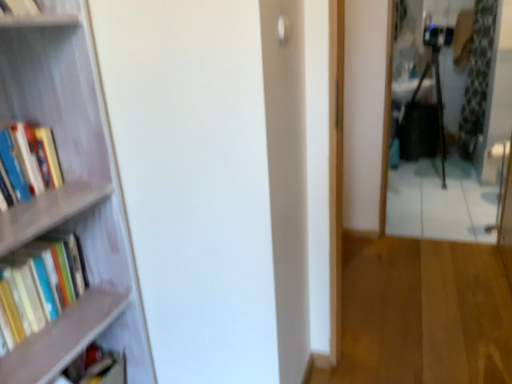
Question: Can you confirm if wooden floor at center is positioned to the left of green floral fabric curtain at right?

Choices:
 (A) yes
 (B) no

Answer: (A)

Question: Is wooden floor at center oriented towards green floral fabric curtain at right?

Choices:
 (A) no
 (B) yes

Answer: (A)

Question: Is wooden floor at center not close to green floral fabric curtain at right?

Choices:
 (A) no
 (B) yes

Answer: (B)

Question: From the image's perspective, is wooden floor at center below green floral fabric curtain at right?

Choices:
 (A) yes
 (B) no

Answer: (A)

Question: Considering the relative sizes of wooden floor at center and green floral fabric curtain at right in the image provided, is wooden floor at center bigger than green floral fabric curtain at right?

Choices:
 (A) yes
 (B) no

Answer: (B)

Question: From a real-world perspective, relative to metallic reflective mirror at right, is green floral fabric curtain at right vertically above or below?

Choices:
 (A) below
 (B) above

Answer: (B)

Question: From the image's perspective, relative to metallic reflective mirror at right, is green floral fabric curtain at right above or below?

Choices:
 (A) below
 (B) above

Answer: (B)

Question: In terms of width, does green floral fabric curtain at right look wider or thinner when compared to metallic reflective mirror at right?

Choices:
 (A) thin
 (B) wide

Answer: (B)

Question: In terms of size, does green floral fabric curtain at right appear bigger or smaller than metallic reflective mirror at right?

Choices:
 (A) big
 (B) small

Answer: (A)

Question: Does point (117, 362) appear closer or farther from the camera than point (41, 132)?

Choices:
 (A) farther
 (B) closer

Answer: (A)

Question: Looking at the image, does matte black book at lower left, acting as the 1th book starting from the bottom, seem bigger or smaller compared to hardcover books at left, which ranks as the first book in top-to-bottom order?

Choices:
 (A) big
 (B) small

Answer: (B)

Question: Do you think matte black book at lower left, acting as the 1th book starting from the bottom, is within hardcover books at left, which ranks as the first book in top-to-bottom order, or outside of it?

Choices:
 (A) inside
 (B) outside

Answer: (B)

Question: From the image's perspective, is matte black book at lower left, acting as the 1th book starting from the bottom, above or below hardcover books at left, the 3th book in the bottom-to-top sequence?

Choices:
 (A) below
 (B) above

Answer: (A)

Question: Would you say hardcover books at left, the 3th book in the bottom-to-top sequence, is to the left or to the right of hardcover books at left, which is the 2th book from bottom to top, in the picture?

Choices:
 (A) right
 (B) left

Answer: (A)

Question: Is hardcover books at left, the 3th book in the bottom-to-top sequence, in front of or behind hardcover books at left, which ranks as the 2th book in top-to-bottom order, in the image?

Choices:
 (A) behind
 (B) front

Answer: (B)